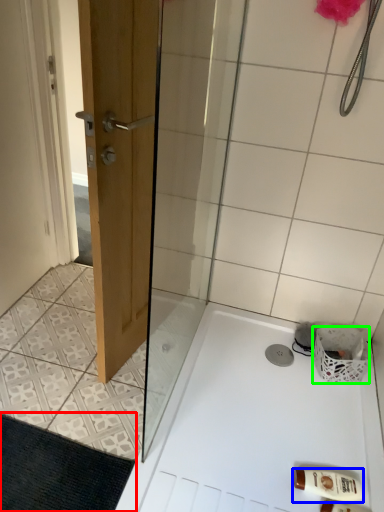
Question: Considering the real-world distances, which object is closest to bath mat (highlighted by a red box)? toiletry (highlighted by a blue box) or basket (highlighted by a green box).

Choices:
 (A) toiletry
 (B) basket

Answer: (A)